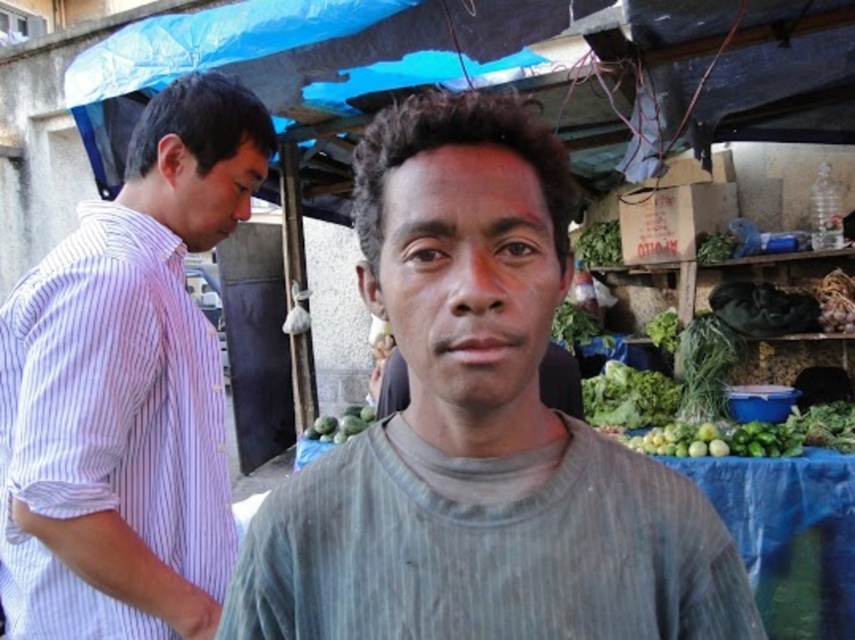
You are standing at the market stall and want to pick up the green matte melon at center. The gray cotton shirt at center is blocking your path. Can you walk around it? Explain why or why not based on their positions.

The gray cotton shirt at center is 7.63 feet away from the green matte melon at center. Since the distance between them is significant, you can easily walk around the gray cotton shirt at center to reach the green matte melon at center.

You are standing at the camera position looking at the market stall. There is a point marked at coordinates [127,388]. What object or person is located at that point?

The point at coordinates [127,388] corresponds to the purple striped shirt at left.

You are standing at the market stall and want to locate the purple striped shirt at left. According to the coordinates provided, where should you look?

The purple striped shirt at left is located at coordinates point [127,388].